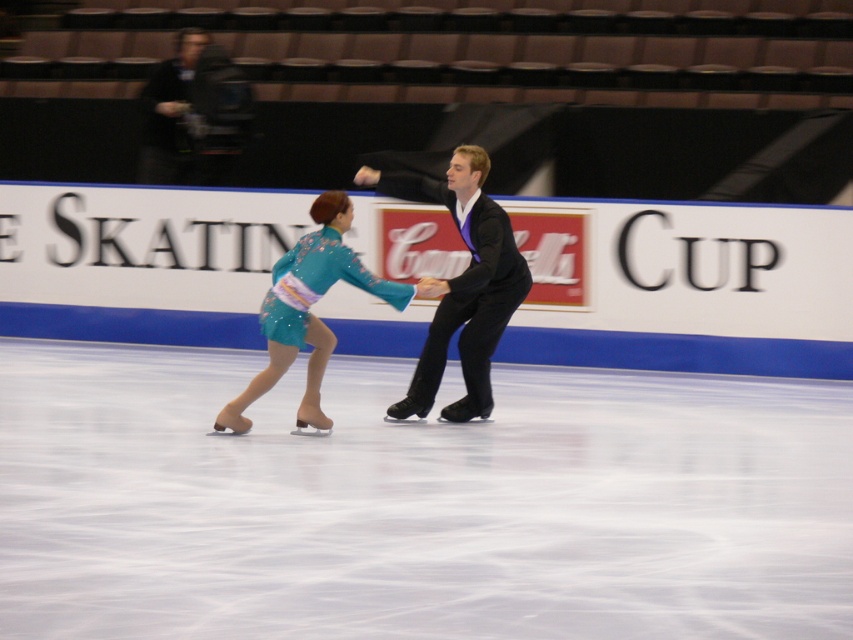
Is shiny black suit at center thinner than teal satin dress at center?

Correct, shiny black suit at center's width is less than teal satin dress at center's.

In the scene shown: Can you confirm if shiny black suit at center is shorter than teal satin dress at center?

No, shiny black suit at center is not shorter than teal satin dress at center.

Between point (457, 408) and point (289, 278), which one is positioned in front?

Positioned in front is point (289, 278).

Locate an element on the screen. shiny black suit at center is located at coordinates (462, 284).

Is point (277, 552) positioned behind point (282, 291)?

No, it is in front of (282, 291).

Measure the distance between white smooth ice at center and teal satin dress at center.

white smooth ice at center and teal satin dress at center are 1.97 meters apart from each other.

Find the location of a particular element. white smooth ice at center is located at coordinates (416, 502).

Between white smooth ice at center and shiny black suit at center, which one has more height?

shiny black suit at center is taller.

What do you see at coordinates (416, 502) in the screenshot?
I see `white smooth ice at center` at bounding box center [416, 502].

Find the location of `white smooth ice at center`. white smooth ice at center is located at coordinates (416, 502).